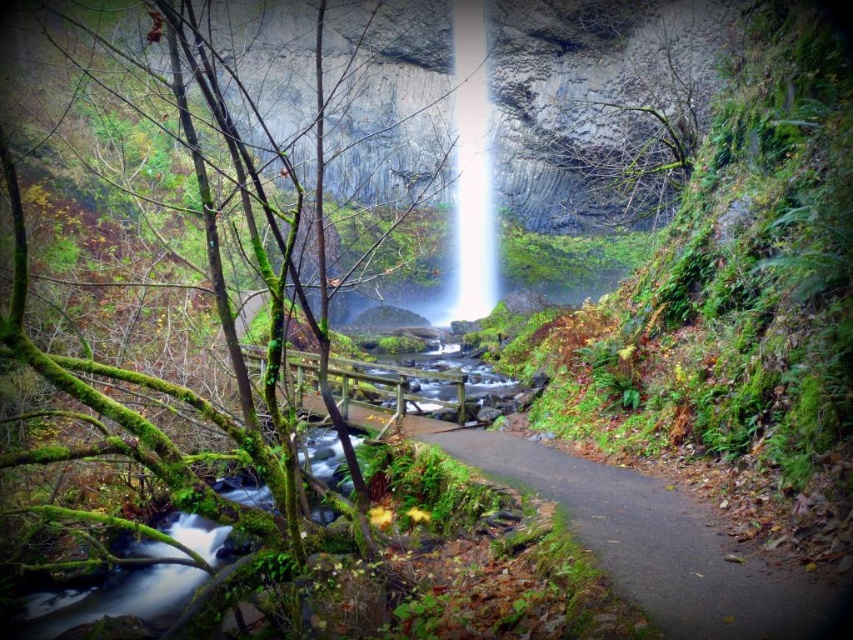
Question: Among these points, which one is nearest to the camera?

Choices:
 (A) (102, 371)
 (B) (460, 93)
 (C) (679, 502)

Answer: (A)

Question: Which point is closer to the camera?

Choices:
 (A) brown dirt path at center
 (B) white translucent waterfall at center
 (C) green mossy tree at center

Answer: (C)

Question: Is green mossy tree at center to the left of brown dirt path at center from the viewer's perspective?

Choices:
 (A) no
 (B) yes

Answer: (B)

Question: Estimate the real-world distances between objects in this image. Which object is farther from the green mossy tree at center?

Choices:
 (A) white translucent waterfall at center
 (B) brown dirt path at center

Answer: (A)

Question: Does brown dirt path at center appear on the right side of white translucent waterfall at center?

Choices:
 (A) no
 (B) yes

Answer: (B)

Question: Does green mossy tree at center have a smaller size compared to white translucent waterfall at center?

Choices:
 (A) yes
 (B) no

Answer: (B)